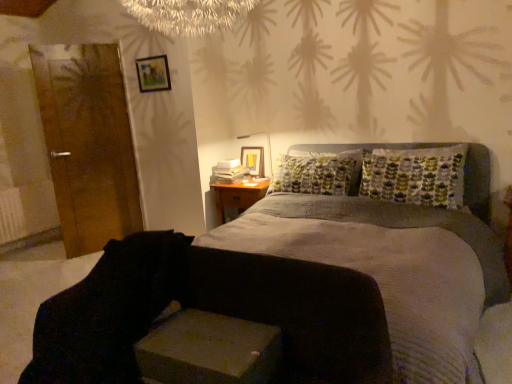
Question: Could you tell me if black fabric swivel chair at lower left is facing wooden door at left?

Choices:
 (A) no
 (B) yes

Answer: (A)

Question: Does black fabric swivel chair at lower left have a smaller size compared to wooden door at left?

Choices:
 (A) yes
 (B) no

Answer: (B)

Question: Considering the relative positions of black fabric swivel chair at lower left and wooden door at left in the image provided, is black fabric swivel chair at lower left to the right of wooden door at left from the viewer's perspective?

Choices:
 (A) yes
 (B) no

Answer: (A)

Question: From the image's perspective, is black fabric swivel chair at lower left on wooden door at left?

Choices:
 (A) no
 (B) yes

Answer: (A)

Question: Can you confirm if black fabric swivel chair at lower left is positioned to the left of wooden door at left?

Choices:
 (A) yes
 (B) no

Answer: (B)

Question: In terms of width, does woodennightstand at right look wider or thinner when compared to wooden frame at upper left?

Choices:
 (A) wide
 (B) thin

Answer: (A)

Question: Would you say woodennightstand at right is inside or outside wooden frame at upper left?

Choices:
 (A) outside
 (B) inside

Answer: (A)

Question: Is point (234, 200) closer or farther from the camera than point (140, 59)?

Choices:
 (A) farther
 (B) closer

Answer: (A)

Question: Is woodennightstand at right taller or shorter than wooden frame at upper left?

Choices:
 (A) short
 (B) tall

Answer: (B)

Question: Would you say textured gray bed at center is to the left or to the right of white plastic table lamp at upper center in the picture?

Choices:
 (A) left
 (B) right

Answer: (B)

Question: In the image, is textured gray bed at center positioned in front of or behind white plastic table lamp at upper center?

Choices:
 (A) front
 (B) behind

Answer: (A)

Question: In terms of height, does textured gray bed at center look taller or shorter compared to white plastic table lamp at upper center?

Choices:
 (A) short
 (B) tall

Answer: (B)

Question: Do you think textured gray bed at center is within white plastic table lamp at upper center, or outside of it?

Choices:
 (A) inside
 (B) outside

Answer: (B)

Question: Choose the correct answer: Is white plastic table lamp at upper center inside wooden door at left or outside it?

Choices:
 (A) outside
 (B) inside

Answer: (A)

Question: Considering the positions of white plastic table lamp at upper center and wooden door at left in the image, is white plastic table lamp at upper center wider or thinner than wooden door at left?

Choices:
 (A) wide
 (B) thin

Answer: (A)